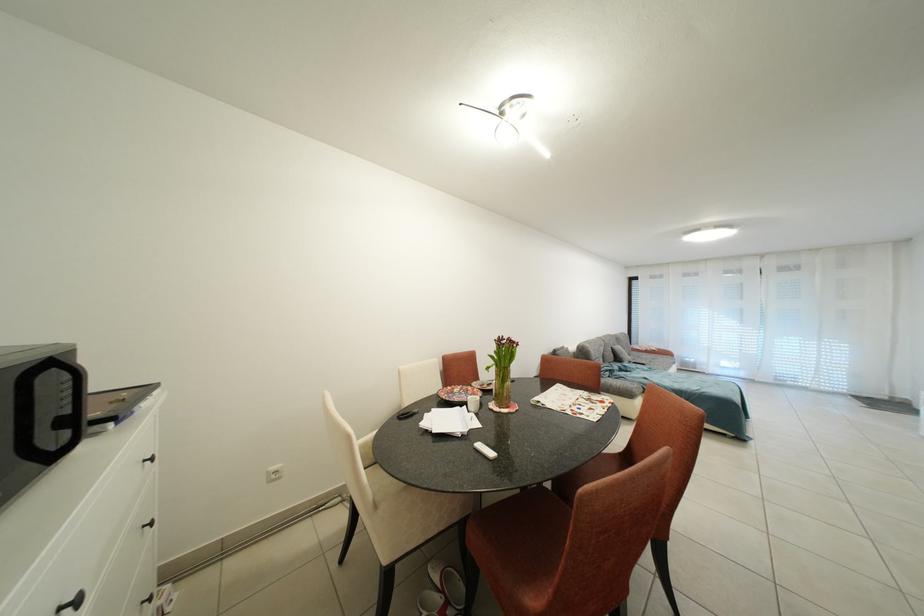
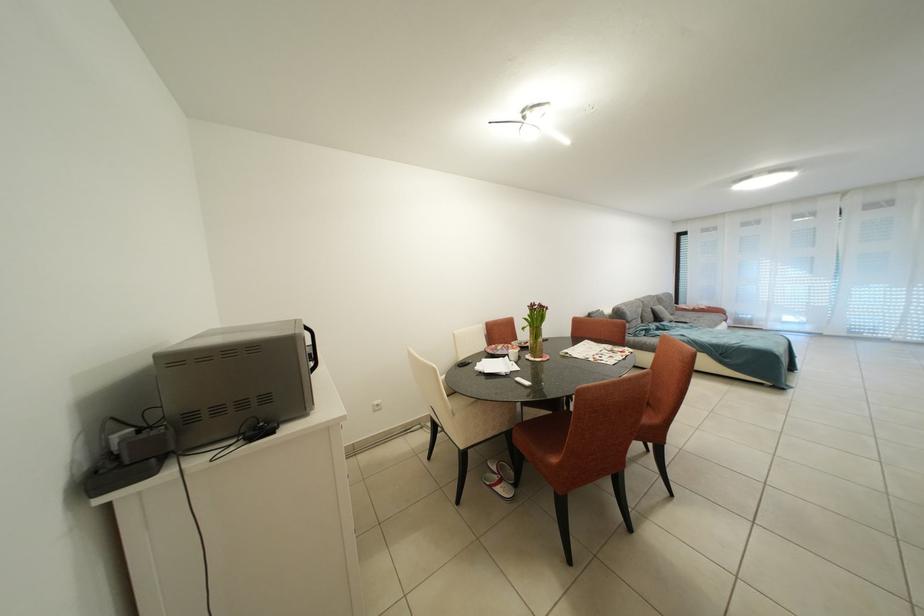
Where in the second image is the point corresponding to (x=445, y=583) from the first image?

(503, 472)